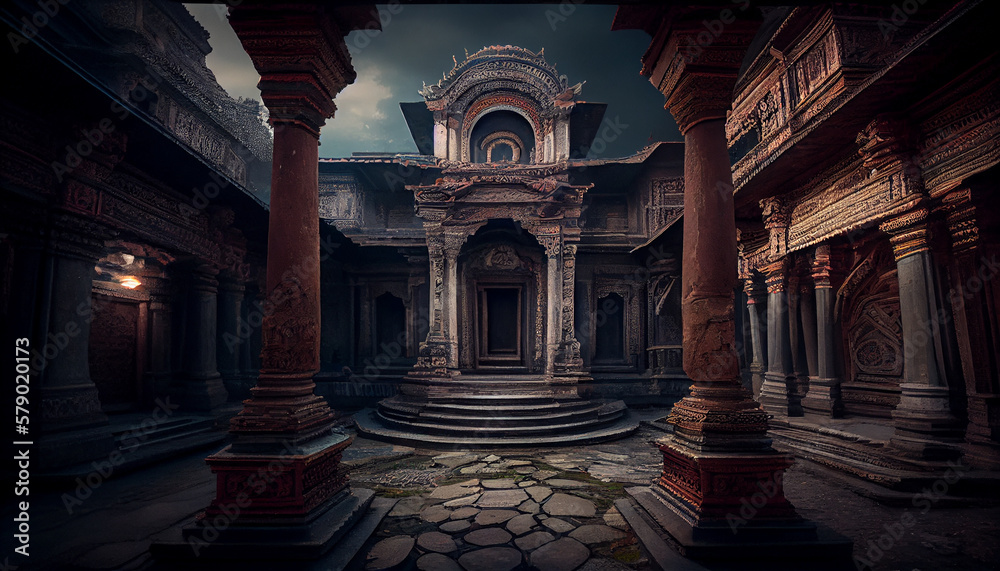
Identify the location of brown columns in center. This screenshot has height=571, width=1000. (298, 249), (714, 256).